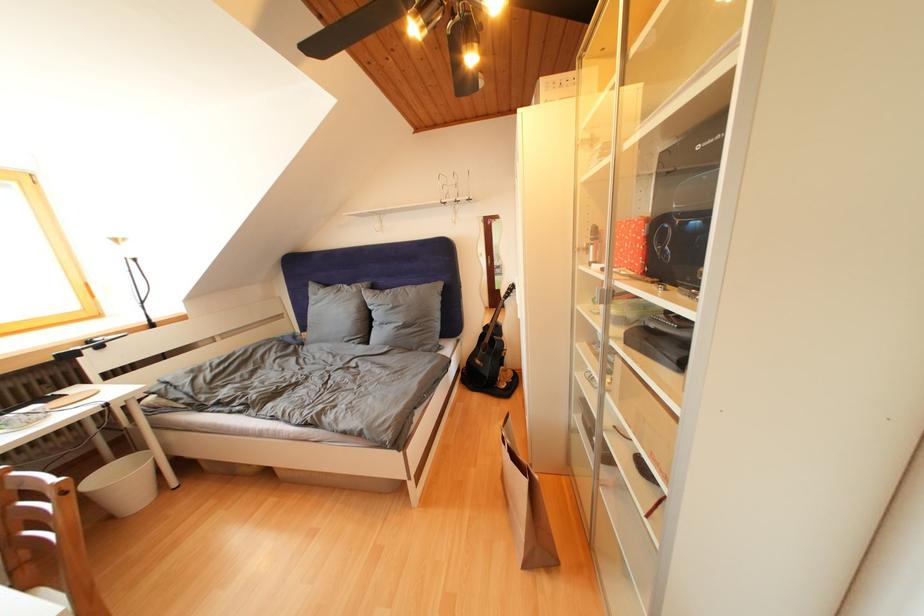
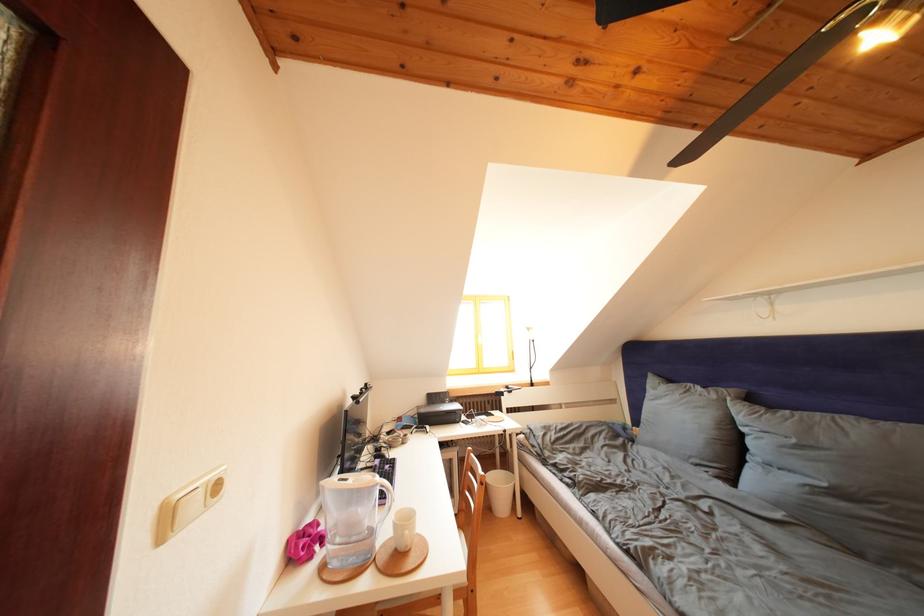
In the second image, find the point that corresponds to [110,469] in the first image.

(503, 472)